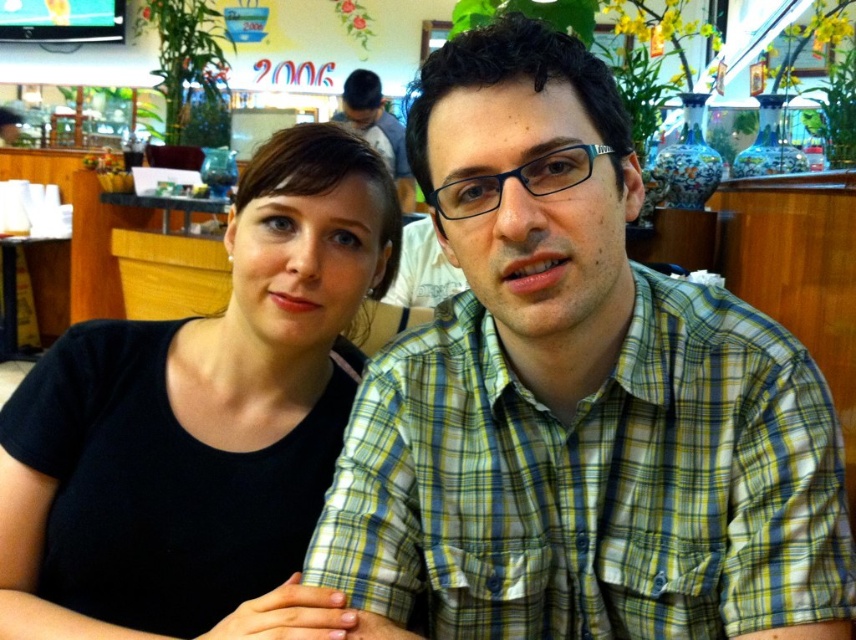
You are a photographer adjusting the camera focus. The minimum focusing distance for your lens is 8 inches. Are both the green plaid shirt at center and the black matte shirt at left within the focusing range?

The green plaid shirt at center is 9.13 inches away from the black matte shirt at left. Since the minimum focusing distance is 8 inches, both shirts are within the focusing range as the distance between them is greater than the minimum requirement.

You are a photographer setting up a shoot in this scene. You need to ensure that the green plaid shirt at center and the black matte shirt at left are both visible in the frame. Given their sizes, which shirt might require you to adjust your camera angle to ensure it doesn not get obscured?

The green plaid shirt at center is smaller than the black matte shirt at left, so the smaller green plaid shirt at center might require adjusting the camera angle to prevent it from being obscured by the larger black matte shirt at left.